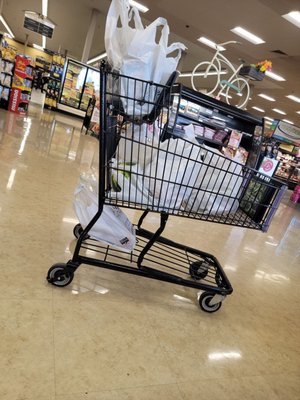
In order to click on light off of floor in this screenshot , I will do `click(225, 357)`, `click(263, 278)`, `click(230, 269)`.